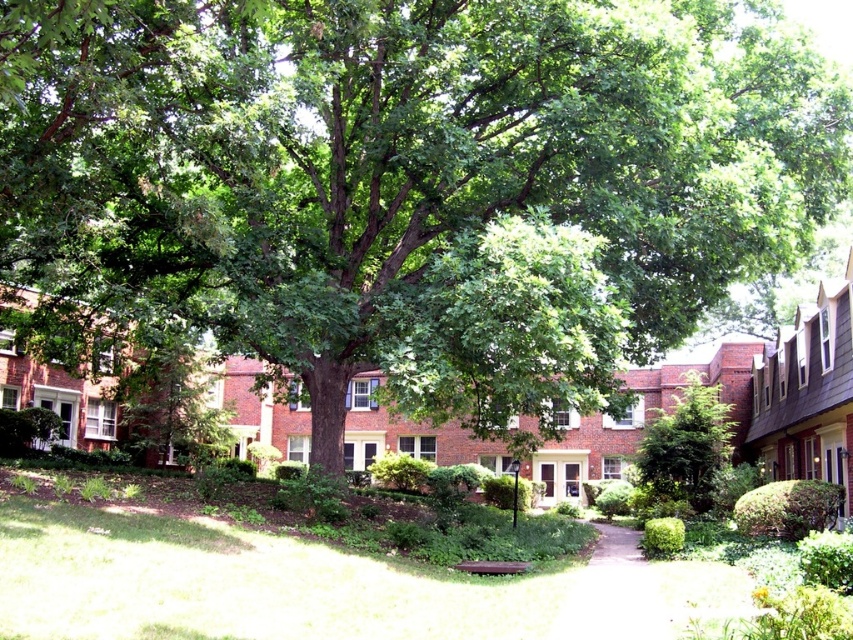
You are a gardener planning to plant a new flower bed between the green leafy tree at center and the white gravel path at center. The flower bed requires a minimum of 8 meters of space between the tree and the path to accommodate its root system. Based on the current distance, is this feasible?

The green leafy tree at center and the white gravel path at center are 7.84 meters apart. Since the required minimum distance is 8 meters, the flower bed cannot be planted as the existing space is insufficient.

You are a gardener planning to plant a new tree in the residential area. The existing green leafy tree at center and the white gravel path at center are already present. Based on their sizes, which one would you consider for potential space adjustments to accommodate the new tree?

The green leafy tree at center has a larger width than the white gravel path at center, so you might consider adjusting the space around the white gravel path at center to make room for the new tree.

You are a gardener planning to plant flowers along the white gravel path at center. Considering the green leafy tree at center, what potential issue should you be aware of when choosing the flower species?

The green leafy tree at center is positioned over the white gravel path at center, so you should choose flowers that can thrive in shaded areas since the tree provides significant shade over the path.